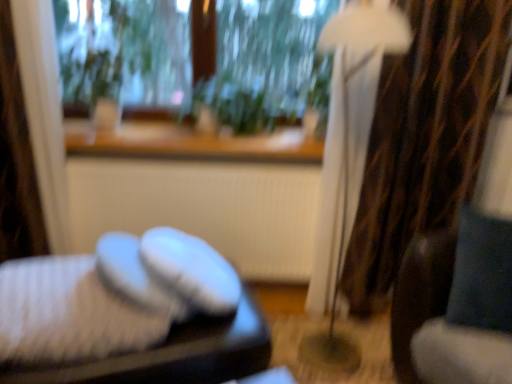
Question: Is velvet blue swivel chair at right inside the boundaries of white knitted socks at lower left, or outside?

Choices:
 (A) outside
 (B) inside

Answer: (A)

Question: From a real-world perspective, relative to white knitted socks at lower left, is velvet blue swivel chair at right vertically above or below?

Choices:
 (A) below
 (B) above

Answer: (B)

Question: Based on their relative distances, which object is farther from the brown textured curtain at right?

Choices:
 (A) white matte radiator at center
 (B) white knitted slippers at lower left
 (C) white fabric lampshade at right
 (D) white knitted socks at lower left
 (E) velvet blue swivel chair at right

Answer: (D)

Question: Which of these objects is positioned farthest from the velvet blue swivel chair at right?

Choices:
 (A) green leafy plant at center
 (B) wooden at upper center
 (C) white fabric lampshade at right
 (D) white matte radiator at center
 (E) brown textured curtain at right

Answer: (A)